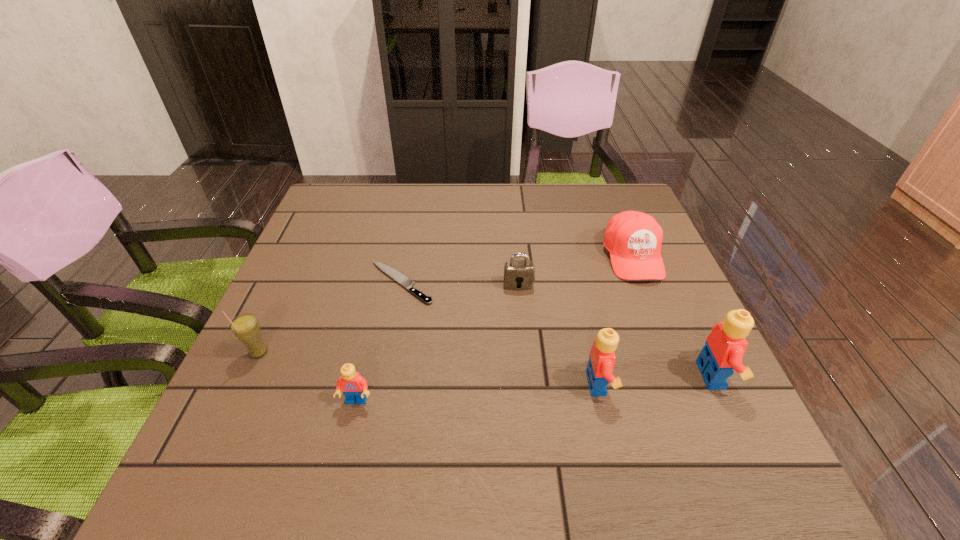
In the image, there is a desktop. What are the coordinates of `vacant space at the right edge` in the screenshot? It's located at (596, 231).

The image size is (960, 540). In order to click on vacant region at the far left corner in this screenshot , I will do `click(366, 185)`.

In order to click on vacant region at the far right corner of the desktop in this screenshot , I will do `click(597, 222)`.

Locate an element on the screen. empty location between the steak knife and the second tallest Lego is located at coordinates (500, 333).

The image size is (960, 540). Find the location of `free space between the shortest Lego and the rightmost Lego`. free space between the shortest Lego and the rightmost Lego is located at coordinates (535, 388).

The height and width of the screenshot is (540, 960). I want to click on unoccupied area between the rightmost Lego and the straw for drinking, so click(486, 364).

What are the coordinates of `unoccupied area between the fourth object from left to right and the rightmost Lego` in the screenshot? It's located at (615, 330).

Locate an element on the screen. Image resolution: width=960 pixels, height=540 pixels. empty space that is in between the rightmost Lego and the straw for drinking is located at coordinates (486, 364).

The height and width of the screenshot is (540, 960). What are the coordinates of `unoccupied position between the leftmost Lego and the fifth object from left to right` in the screenshot? It's located at (477, 393).

In order to click on free space that is in between the shortest Lego and the rightmost Lego in this screenshot , I will do point(535,388).